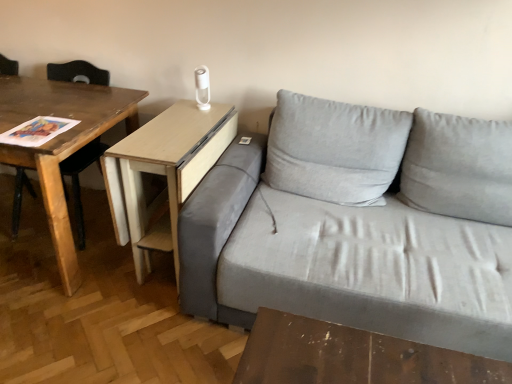
Find the location of a particular element. This screenshot has width=512, height=384. vacant point above light wood/woodenobject at center, which ranks as the first table in right-to-left order (from a real-world perspective) is located at coordinates (177, 132).